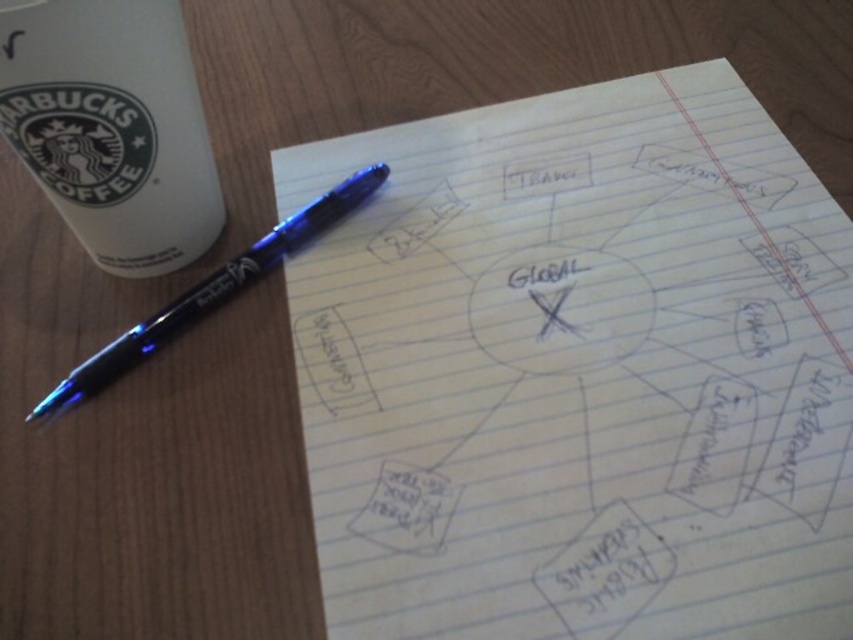
Can you confirm if white lined paper at center is positioned to the right of white matte paper cup at upper left?

Indeed, white lined paper at center is positioned on the right side of white matte paper cup at upper left.

In the scene shown: Which of these two, white lined paper at center or white matte paper cup at upper left, stands taller?

With more height is white lined paper at center.

Is point (675, 320) less distant than point (28, 145)?

No, it is not.

You are a GUI agent. You are given a task and a screenshot of the screen. Output one action in this format:
    pyautogui.click(x=<x>, y=<y>)
    Task: Click on the white lined paper at center
    This screenshot has width=853, height=640.
    Given the screenshot: What is the action you would take?
    pyautogui.click(x=579, y=372)

Is white lined paper at center above blue metallic pen at upper left?

Incorrect, white lined paper at center is not positioned above blue metallic pen at upper left.

Based on the photo, how much distance is there between white lined paper at center and blue metallic pen at upper left?

The distance of white lined paper at center from blue metallic pen at upper left is 8.86 inches.

Who is more distant from viewer, (492, 209) or (300, 220)?

Positioned behind is point (492, 209).

Where is `white lined paper at center`? This screenshot has height=640, width=853. white lined paper at center is located at coordinates 579,372.

Is white matte paper cup at upper left bigger than blue metallic pen at upper left?

Actually, white matte paper cup at upper left might be smaller than blue metallic pen at upper left.

Between point (199, 179) and point (207, 300), which one is positioned behind?

Point (199, 179)

Who is more distant from viewer, (107, 228) or (248, 269)?

Point (248, 269)

Find the location of a particular element. white matte paper cup at upper left is located at coordinates (111, 125).